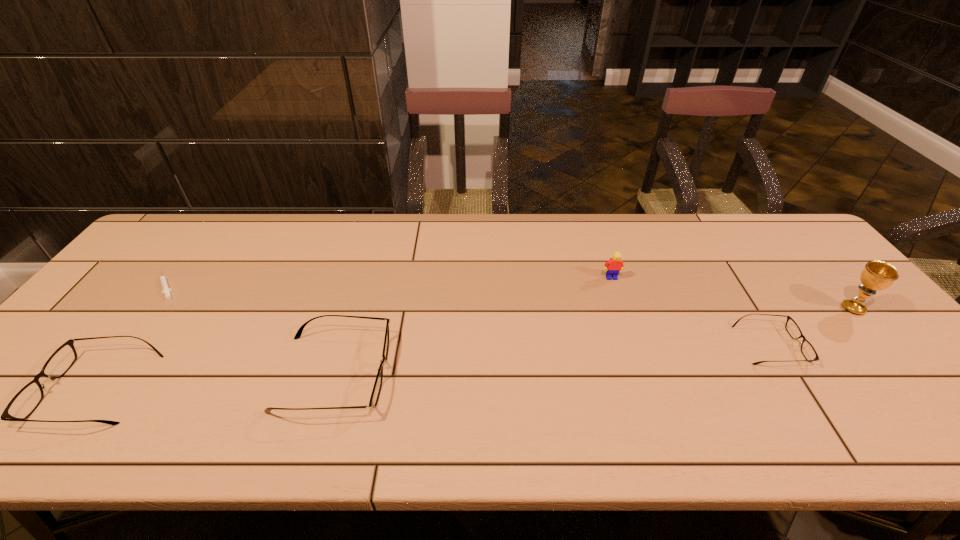
Please mark a free spot for a new spectacles to balance the arrangement. Please provide its 2D coordinates. Your answer should be formatted as a tuple, i.e. [(x, y)], where the tuple contains the x and y coordinates of a point satisfying the conditions above.

[(559, 359)]